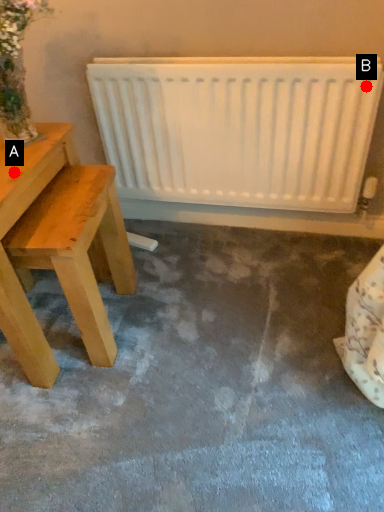
Question: Two points are circled on the image, labeled by A and B beside each circle. Which point is farther from the camera taking this photo?

Choices:
 (A) A is further
 (B) B is further

Answer: (B)